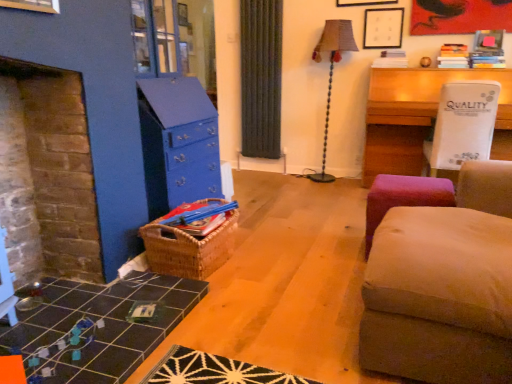
The width and height of the screenshot is (512, 384). Identify the location of vacant area located to the right-hand side of woven brown basket at center. 265,260.